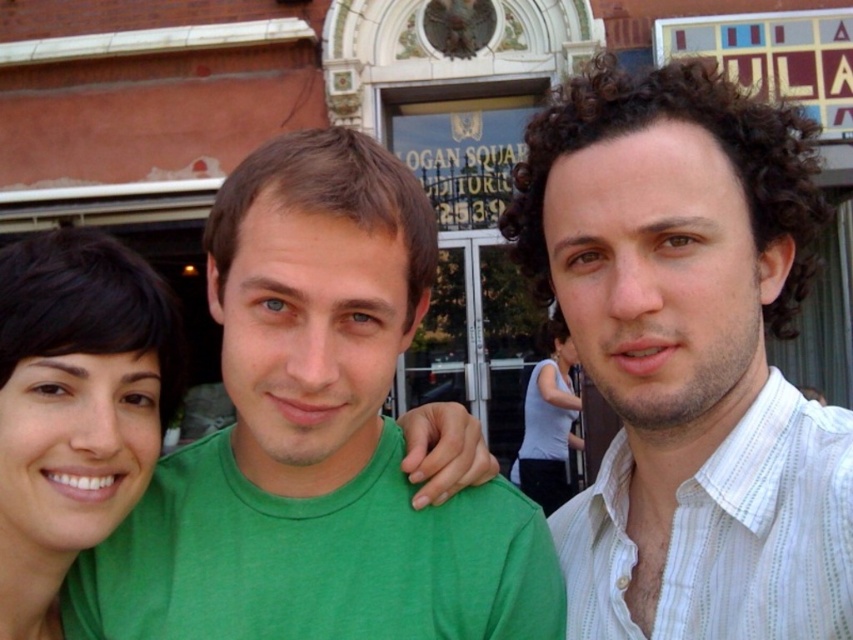
How distant is green matte shirt at center from white matte tank top at center?

green matte shirt at center is 13.11 meters from white matte tank top at center.

Identify the location of green matte shirt at center. The width and height of the screenshot is (853, 640). (315, 440).

Between point (250, 176) and point (555, 456), which one is positioned behind?

Positioned behind is point (555, 456).

Locate an element on the screen. The image size is (853, 640). green matte shirt at center is located at coordinates point(315,440).

Which of these two, matte green shirt at left or white striped shirt at right, stands shorter?

white striped shirt at right

Is matte green shirt at left positioned at the back of white striped shirt at right?

That is True.

Who is more forward, (70, 515) or (589, 632)?

Point (70, 515)

Locate an element on the screen. matte green shirt at left is located at coordinates (74, 406).

Is green matte shirt at center shorter than matte green shirt at left?

Incorrect, green matte shirt at center's height does not fall short of matte green shirt at left's.

Is green matte shirt at center thinner than matte green shirt at left?

In fact, green matte shirt at center might be wider than matte green shirt at left.

What do you see at coordinates (315, 440) in the screenshot? The height and width of the screenshot is (640, 853). I see `green matte shirt at center` at bounding box center [315, 440].

I want to click on green matte shirt at center, so click(x=315, y=440).